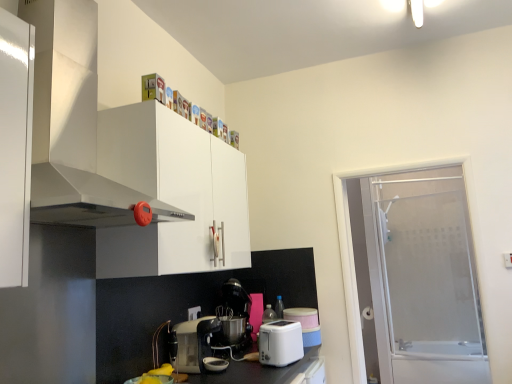
Question: Is frosted glass screen door at right wider than metallic silver coffee machine at center?

Choices:
 (A) yes
 (B) no

Answer: (B)

Question: From the image's perspective, is frosted glass screen door at right located beneath metallic silver coffee machine at center?

Choices:
 (A) no
 (B) yes

Answer: (A)

Question: Considering the relative positions of frosted glass screen door at right and metallic silver coffee machine at center in the image provided, is frosted glass screen door at right to the right of metallic silver coffee machine at center from the viewer's perspective?

Choices:
 (A) yes
 (B) no

Answer: (A)

Question: Can you confirm if frosted glass screen door at right is shorter than metallic silver coffee machine at center?

Choices:
 (A) yes
 (B) no

Answer: (B)

Question: Is frosted glass screen door at right not near metallic silver coffee machine at center?

Choices:
 (A) yes
 (B) no

Answer: (A)

Question: Considering the positions of white plastic toaster at lower center, the 2th kitchen appliance positioned from the left, and frosted glass screen door at right in the image, is white plastic toaster at lower center, the 2th kitchen appliance positioned from the left, wider or thinner than frosted glass screen door at right?

Choices:
 (A) wide
 (B) thin

Answer: (B)

Question: In the image, is white plastic toaster at lower center, the 1th kitchen appliance in the right-to-left sequence, positioned in front of or behind frosted glass screen door at right?

Choices:
 (A) front
 (B) behind

Answer: (A)

Question: From the image's perspective, is white plastic toaster at lower center, the 2th kitchen appliance positioned from the left, positioned above or below frosted glass screen door at right?

Choices:
 (A) above
 (B) below

Answer: (B)

Question: Is white plastic toaster at lower center, the 2th kitchen appliance positioned from the left, bigger or smaller than frosted glass screen door at right?

Choices:
 (A) big
 (B) small

Answer: (B)

Question: Is metallic silver coffee maker at center, the 2th kitchen appliance viewed from the right, bigger or smaller than white plastic electric outlet at lower center?

Choices:
 (A) small
 (B) big

Answer: (B)

Question: Is metallic silver coffee maker at center, which is counted as the 1th kitchen appliance, starting from the left, taller or shorter than white plastic electric outlet at lower center?

Choices:
 (A) tall
 (B) short

Answer: (A)

Question: Is metallic silver coffee maker at center, the 2th kitchen appliance viewed from the right, inside or outside of white plastic electric outlet at lower center?

Choices:
 (A) outside
 (B) inside

Answer: (A)

Question: Based on their positions, is metallic silver coffee maker at center, which is counted as the 1th kitchen appliance, starting from the left, located to the left or right of white plastic electric outlet at lower center?

Choices:
 (A) right
 (B) left

Answer: (A)

Question: Is white glossy range hood at upper left to the left or to the right of frosted glass screen door at right in the image?

Choices:
 (A) right
 (B) left

Answer: (B)

Question: Looking at their shapes, would you say white glossy range hood at upper left is wider or thinner than frosted glass screen door at right?

Choices:
 (A) thin
 (B) wide

Answer: (B)